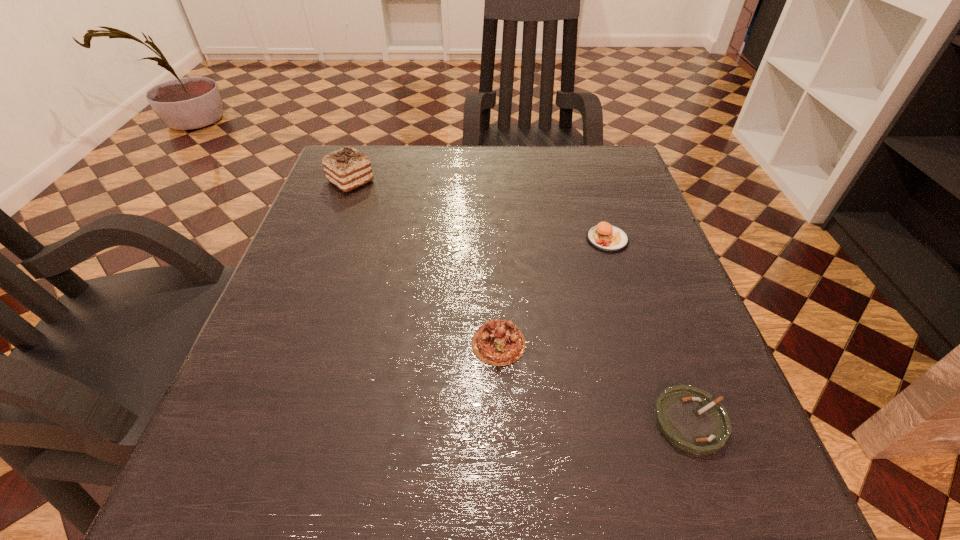
This screenshot has width=960, height=540. What are the coordinates of `empty location between the patty and the shortest object` in the screenshot? It's located at (649, 330).

The height and width of the screenshot is (540, 960). Find the location of `vacant space that's between the nearest object and the taller chocolate cake`. vacant space that's between the nearest object and the taller chocolate cake is located at coordinates (520, 301).

I want to click on vacant area that lies between the farthest object and the ashtray, so pyautogui.click(x=520, y=301).

Where is `the second closest object relative to the shortest object`? The image size is (960, 540). the second closest object relative to the shortest object is located at coordinates (605, 237).

What are the coordinates of `the second closest object to the nearest object` in the screenshot? It's located at (605, 237).

This screenshot has height=540, width=960. What are the coordinates of `free point that satisfies the following two spatial constraints: 1. on the front side of the farther chocolate cake; 2. on the right side of the shorter chocolate cake` in the screenshot? It's located at (290, 343).